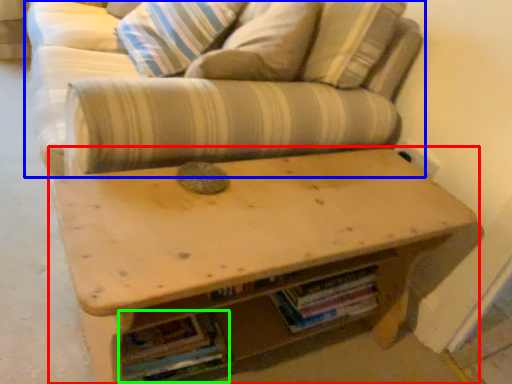
Question: Considering the real-world distances, which object is closest to table (highlighted by a red box)? studio couch (highlighted by a blue box) or book (highlighted by a green box).

Choices:
 (A) studio couch
 (B) book

Answer: (A)